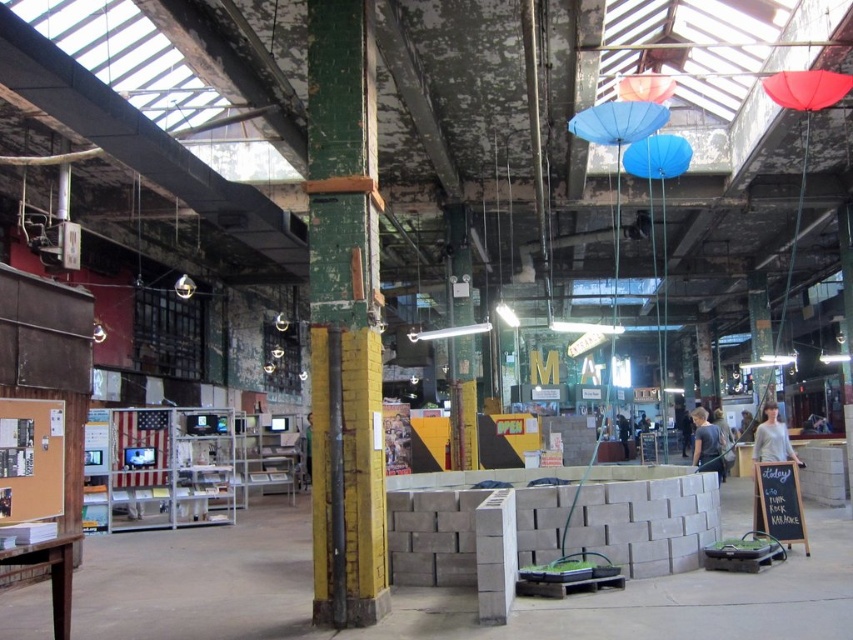
Question: Which of these objects is positioned closest to the blue fabric umbrella at upper center?

Choices:
 (A) green painted wood at center
 (B) gray cotton shirt at right
 (C) light brown leather jacket at center

Answer: (B)

Question: Considering the real-world distances, which object is closest to the green painted wood at center?

Choices:
 (A) dark blue t-shirt at center
 (B) gray cotton shirt at right

Answer: (A)

Question: Can you confirm if green painted wood at center is wider than blue fabric umbrella at upper center?

Choices:
 (A) yes
 (B) no

Answer: (B)

Question: Can you confirm if blue fabric umbrella at upper center is thinner than gray cotton shirt at right?

Choices:
 (A) yes
 (B) no

Answer: (A)

Question: Estimate the real-world distances between objects in this image. Which object is closer to the dark blue t-shirt at center?

Choices:
 (A) gray cotton shirt at right
 (B) green painted wood at center

Answer: (A)

Question: Is blue fabric umbrella at upper center to the left of dark blue t-shirt at center from the viewer's perspective?

Choices:
 (A) yes
 (B) no

Answer: (A)